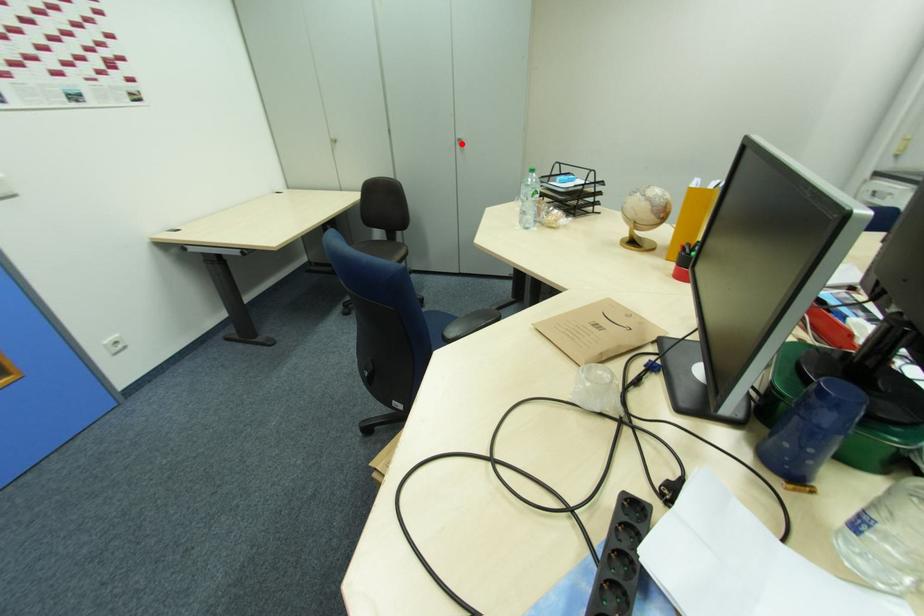
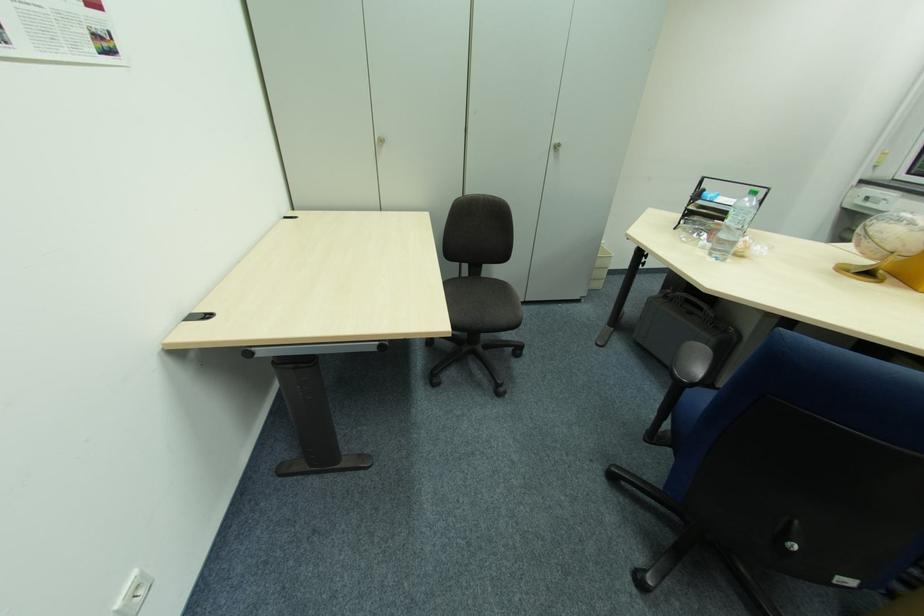
Question: I am providing you with two images of the same scene from different viewpoints. A red point is marked on the first image. At the location where the point appears in image 1, is it still visible in image 2?

Choices:
 (A) Yes
 (B) No

Answer: (A)